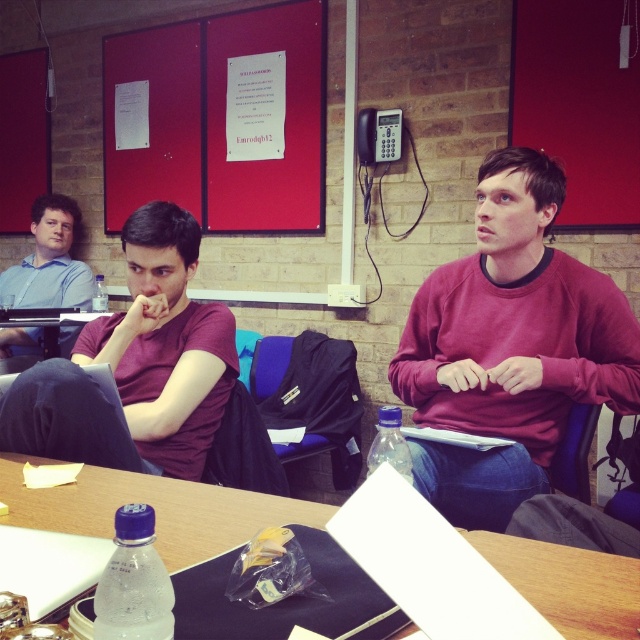
Question: Which object is closer to the camera taking this photo?

Choices:
 (A) wooden table at center
 (B) matte blue shirt at left
 (C) maroon sweatshirt at center

Answer: (A)

Question: Is maroon sweatshirt at center to the left of wooden table at center from the viewer's perspective?

Choices:
 (A) no
 (B) yes

Answer: (A)

Question: Which of the following is the farthest from the observer?

Choices:
 (A) matte blue shirt at left
 (B) wooden table at center

Answer: (A)

Question: Does maroon sweatshirt at center have a larger size compared to wooden table at center?

Choices:
 (A) no
 (B) yes

Answer: (B)

Question: Is maroon sweatshirt at center to the right of matte blue shirt at left from the viewer's perspective?

Choices:
 (A) yes
 (B) no

Answer: (A)

Question: Which point is closer to the camera?

Choices:
 (A) (76, 289)
 (B) (452, 524)

Answer: (B)